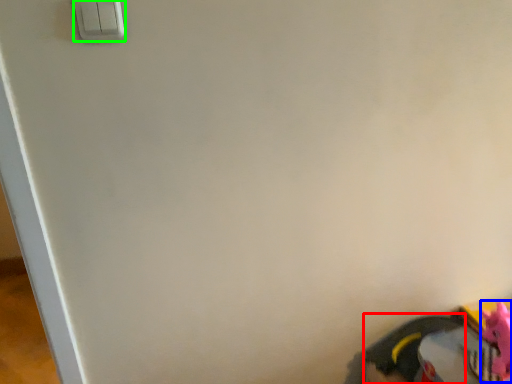
Question: Estimate the real-world distances between objects in this image. Which object is farther from footwear (highlighted by a red box), toy (highlighted by a blue box) or light switch (highlighted by a green box)?

Choices:
 (A) toy
 (B) light switch

Answer: (B)